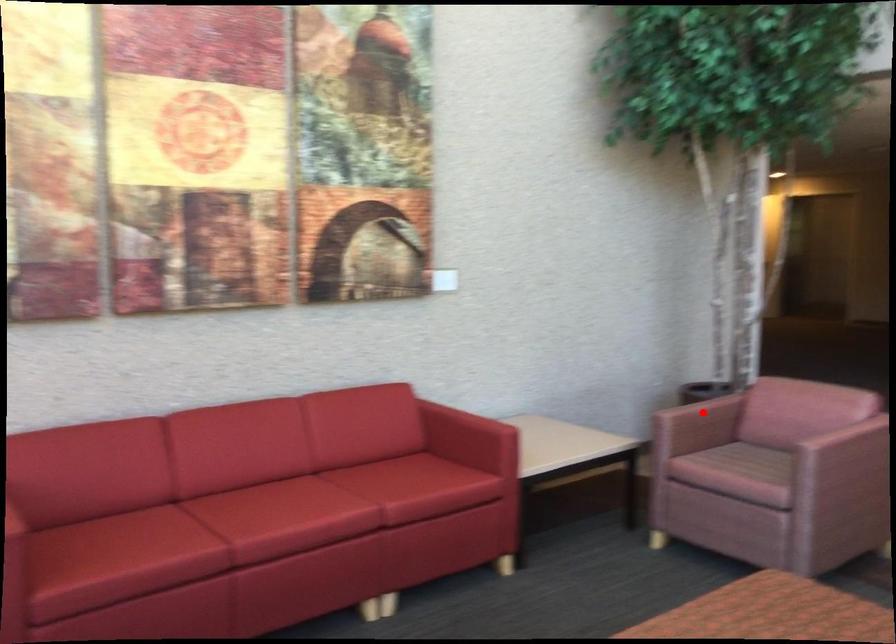
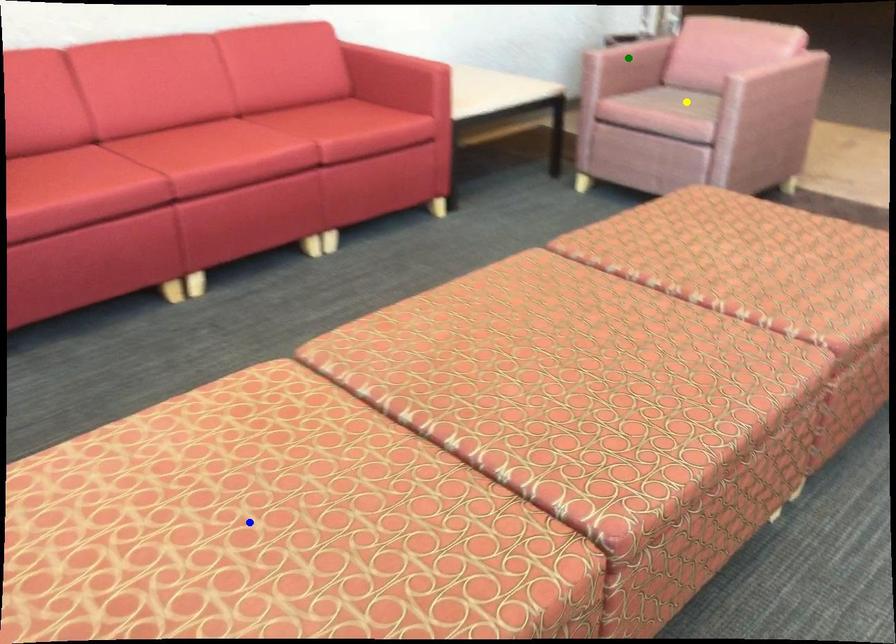
Question: I am providing you with two images of the same scene from different viewpoints. A red point is marked on the first image. You are given multiple points on the second image. Which point in image 2 is actually the same real-world point as the red point in image 1?

Choices:
 (A) green point
 (B) yellow point
 (C) blue point

Answer: (A)